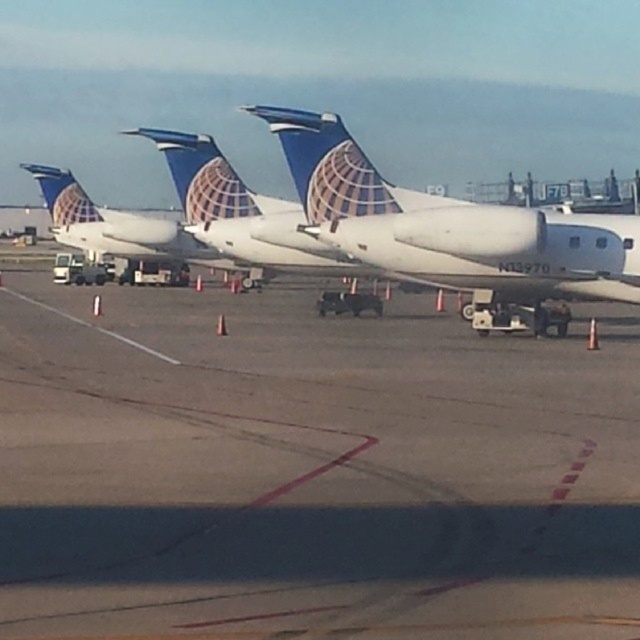
You are standing on the airport tarmac and want to walk to the white matte airplane at center. Which direction should you move in relation to the smooth asphalt tarmac at center?

Since the smooth asphalt tarmac at center is closer to you than the white matte airplane at center, you should move away from the smooth asphalt tarmac at center to reach the white matte airplane at center.

You are a pilot who just landed your plane and need to park it on the smooth asphalt tarmac at center. Your plane is the white matte airplane at center. Can you safely park your plane on the tarmac without any height restrictions?

The smooth asphalt tarmac at center is not as tall as the white matte airplane at center, so there is no height restriction preventing the plane from parking safely on the tarmac.

From the picture: You are a ground crew member checking the parking area for the white matte airplane at center. Based on the image, is the smooth asphalt tarmac at center large enough to accommodate the airplane?

The smooth asphalt tarmac at center has a smaller size compared to the white matte airplane at center, so it is not large enough to accommodate the airplane.